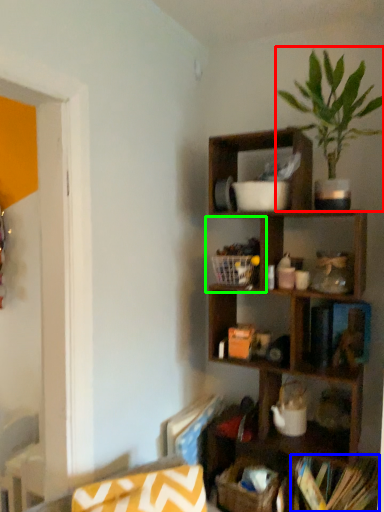
Question: Estimate the real-world distances between objects in this image. Which object is farther from houseplant (highlighted by a red box), book (highlighted by a blue box) or cabinet (highlighted by a green box)?

Choices:
 (A) book
 (B) cabinet

Answer: (A)